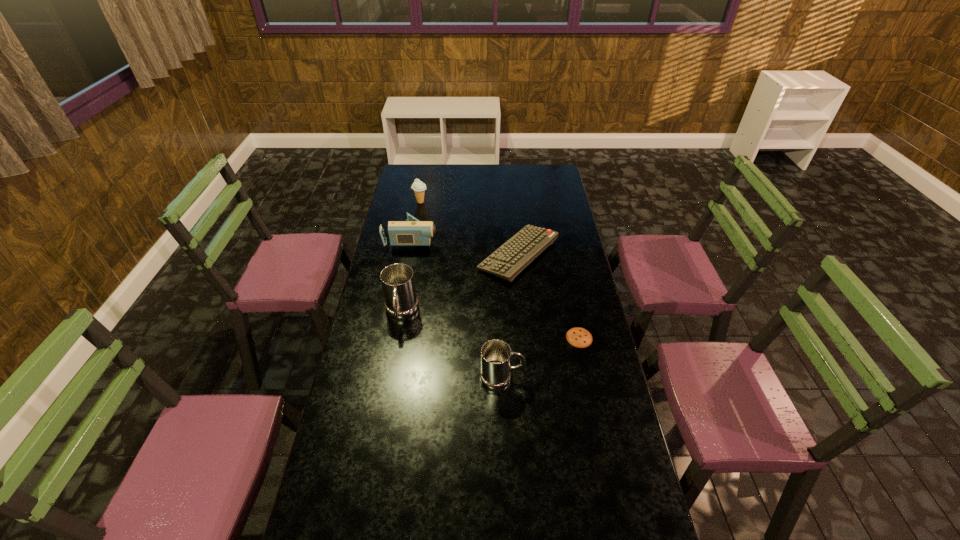
Where is `free space that is in between the right mug and the cookie`? The image size is (960, 540). free space that is in between the right mug and the cookie is located at coordinates (540, 357).

Where is `vacant area that lies between the camcorder and the cookie`? The height and width of the screenshot is (540, 960). vacant area that lies between the camcorder and the cookie is located at coordinates (495, 288).

This screenshot has height=540, width=960. I want to click on free space between the computer keyboard and the cookie, so pos(549,296).

Identify the location of object that is the fourth closest to the farthest object. (579, 337).

Point out which object is positioned as the fifth nearest to the cookie. Please provide its 2D coordinates. Your answer should be formatted as a tuple, i.e. [(x, y)], where the tuple contains the x and y coordinates of a point satisfying the conditions above.

[(419, 187)]

At what (x,y) coordinates should I click in order to perform the action: click on free location that satisfies the following two spatial constraints: 1. on the side of the shortest object with the handle; 2. on the left side of the taller mug. Please return your answer as a coordinate pair (x, y). Looking at the image, I should click on (397, 338).

The image size is (960, 540). In order to click on free location that satisfies the following two spatial constraints: 1. on the side of the cookie with the flip-out screen; 2. on the right side of the camcorder in this screenshot , I will do `click(394, 338)`.

Where is `blank area in the image that satisfies the following two spatial constraints: 1. on the side of the cookie with the handle; 2. on the left side of the farther mug`? Image resolution: width=960 pixels, height=540 pixels. blank area in the image that satisfies the following two spatial constraints: 1. on the side of the cookie with the handle; 2. on the left side of the farther mug is located at coordinates (397, 338).

Image resolution: width=960 pixels, height=540 pixels. I want to click on vacant region that satisfies the following two spatial constraints: 1. on the front side of the icecream; 2. on the right side of the second shortest object, so coord(411,255).

Where is `vacant region that satisfies the following two spatial constraints: 1. on the front side of the shortest object; 2. on the side of the nearest object with the handle`? vacant region that satisfies the following two spatial constraints: 1. on the front side of the shortest object; 2. on the side of the nearest object with the handle is located at coordinates (588, 377).